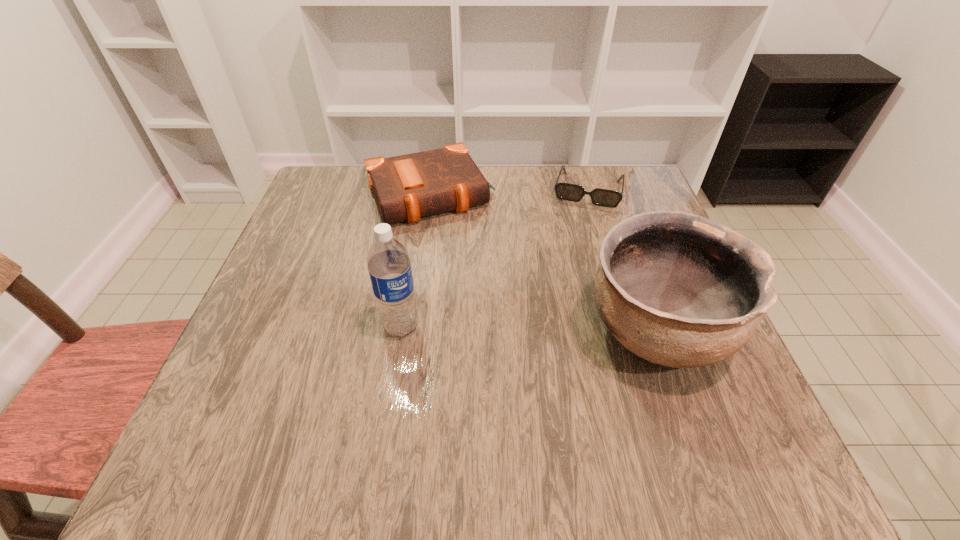
The height and width of the screenshot is (540, 960). Identify the location of free space between the water bottle and the third tallest object. (416, 261).

Locate an element on the screen. This screenshot has width=960, height=540. the third closest object to the shortest object is located at coordinates (389, 266).

Identify which object is located as the nearest to the water bottle. Please provide its 2D coordinates. Your answer should be formatted as a tuple, i.e. [(x, y)], where the tuple contains the x and y coordinates of a point satisfying the conditions above.

[(407, 187)]

Where is `vacant space that satisfies the following two spatial constraints: 1. on the front side of the pottery; 2. on the left side of the tallest object`? vacant space that satisfies the following two spatial constraints: 1. on the front side of the pottery; 2. on the left side of the tallest object is located at coordinates (400, 331).